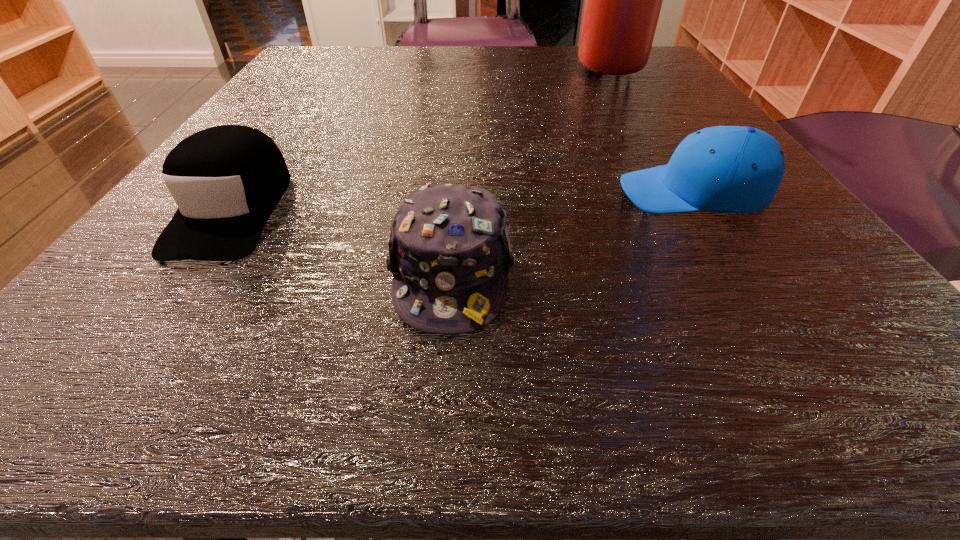
The height and width of the screenshot is (540, 960). What are the coordinates of `vacant space situated on the front-facing side of the rightmost headwear` in the screenshot? It's located at (326, 192).

Identify the location of vacant area situated 0.080m on the front-facing side of the leftmost headwear. The image size is (960, 540). click(x=154, y=322).

You are a GUI agent. You are given a task and a screenshot of the screen. Output one action in this format:
    pyautogui.click(x=<x>, y=<y>)
    Task: Click on the free space located 0.050m on the front-facing side of the second headwear from left to right
    This screenshot has height=540, width=960.
    Given the screenshot: What is the action you would take?
    pyautogui.click(x=444, y=386)

Where is `object that is at the far edge`? This screenshot has width=960, height=540. object that is at the far edge is located at coordinates (623, 0).

I want to click on object at the near edge, so click(449, 250).

Locate an element on the screen. The width and height of the screenshot is (960, 540). object positioned at the left edge is located at coordinates (226, 180).

Where is `fire extinguisher located in the right edge section of the desktop`? fire extinguisher located in the right edge section of the desktop is located at coordinates coord(623,0).

At what (x,y) coordinates should I click in order to perform the action: click on cap positioned at the right edge. Please return your answer as a coordinate pair (x, y). Image resolution: width=960 pixels, height=540 pixels. Looking at the image, I should click on (726, 169).

At what (x,y) coordinates should I click in order to perform the action: click on object positioned at the far right corner. Please return your answer as a coordinate pair (x, y). Looking at the image, I should click on (623, 0).

What are the coordinates of `vacant region at the far edge of the desktop` in the screenshot? It's located at (472, 72).